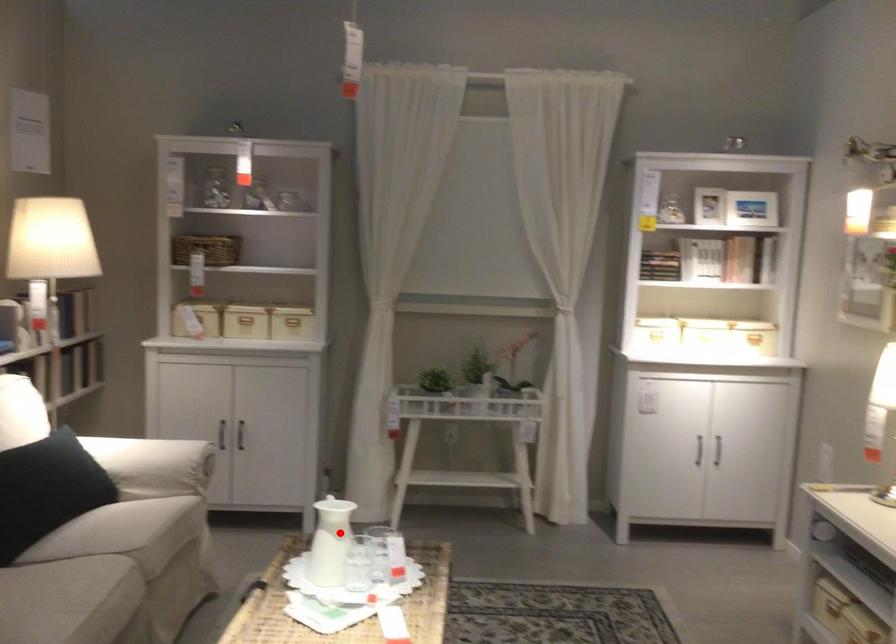
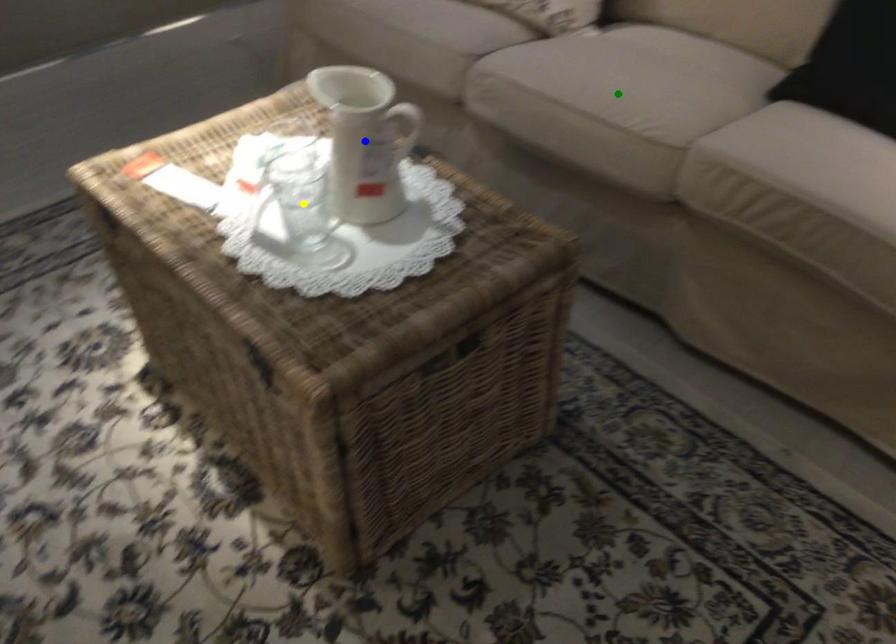
Question: I am providing you with two images of the same scene from different viewpoints. A red point is marked on the first image. You are given multiple points on the second image. In image 2, which mark is for the same physical point as the one in image 1?

Choices:
 (A) yellow point
 (B) blue point
 (C) green point

Answer: (B)